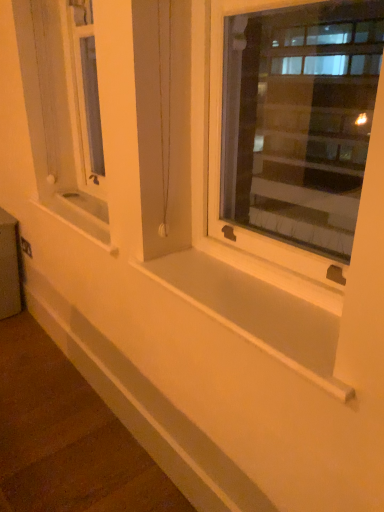
Question: Is white plastic window at center facing away from white smooth ledge at lower center?

Choices:
 (A) yes
 (B) no

Answer: (B)

Question: Considering the relative sizes of white plastic window at center and white smooth ledge at lower center in the image provided, is white plastic window at center taller than white smooth ledge at lower center?

Choices:
 (A) no
 (B) yes

Answer: (B)

Question: Does white plastic window at center appear on the right side of white smooth ledge at lower center?

Choices:
 (A) yes
 (B) no

Answer: (A)

Question: Is white smooth ledge at lower center completely or partially inside white plastic window at center?

Choices:
 (A) yes
 (B) no

Answer: (B)

Question: Is white plastic window at center aimed at white smooth ledge at lower center?

Choices:
 (A) yes
 (B) no

Answer: (B)

Question: Is white plastic window at center smaller than white smooth ledge at lower center?

Choices:
 (A) no
 (B) yes

Answer: (A)

Question: Is white smooth window sill at center, which is the 1th window sill in bottom-to-top order, at the right side of white smooth window sill at center, marked as the second window sill in a front-to-back arrangement?

Choices:
 (A) yes
 (B) no

Answer: (A)

Question: Can you confirm if white smooth window sill at center, which is the 2th window sill from top to bottom, is taller than white smooth window sill at center, marked as the second window sill in a front-to-back arrangement?

Choices:
 (A) no
 (B) yes

Answer: (A)

Question: Could you tell me if white smooth window sill at center, acting as the 1th window sill starting from the front, is turned towards white smooth window sill at center, marked as the second window sill in a front-to-back arrangement?

Choices:
 (A) no
 (B) yes

Answer: (A)

Question: From a real-world perspective, is white smooth window sill at center, acting as the 1th window sill starting from the front, physically above white smooth window sill at center, which is counted as the second window sill, starting from the right?

Choices:
 (A) yes
 (B) no

Answer: (B)

Question: Is white smooth window sill at center, positioned as the 2th window sill in back-to-front order, closer to camera compared to white smooth window sill at center, the second window sill positioned from the bottom?

Choices:
 (A) no
 (B) yes

Answer: (B)

Question: From the image's perspective, is white smooth window sill at center, marked as the first window sill in a right-to-left arrangement, on white smooth window sill at center, which is counted as the second window sill, starting from the right?

Choices:
 (A) no
 (B) yes

Answer: (A)

Question: Is metallic silver window box at lower left shorter than white smooth window sill at center, marked as the first window sill in a right-to-left arrangement?

Choices:
 (A) no
 (B) yes

Answer: (A)